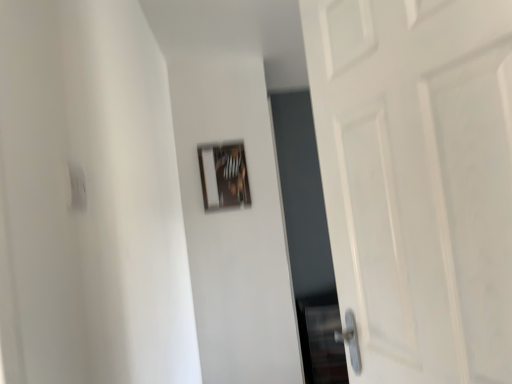
Find the location of a particular element. wooden frame at upper center is located at coordinates (224, 176).

Describe the element at coordinates (224, 176) in the screenshot. I see `wooden frame at upper center` at that location.

Locate an element on the screen. This screenshot has height=384, width=512. wooden frame at upper center is located at coordinates (224, 176).